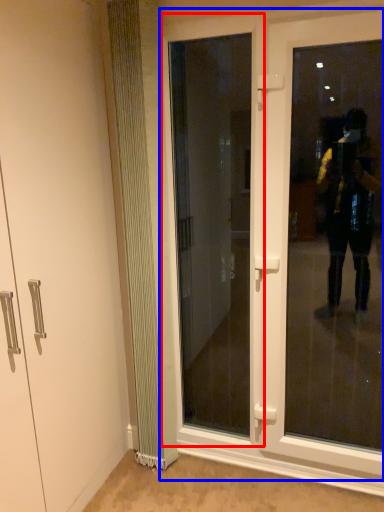
Question: Which of the following is the farthest to the observer, door (highlighted by a red box) or door (highlighted by a blue box)?

Choices:
 (A) door
 (B) door

Answer: (A)